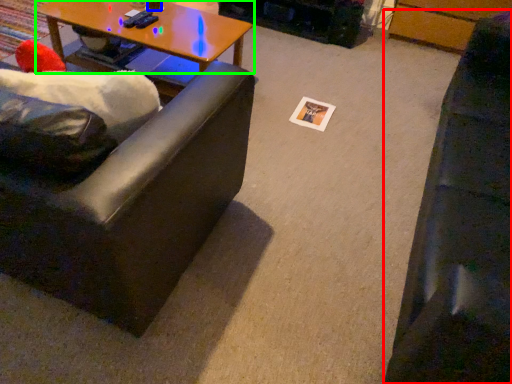
Question: Which object is the closest to the studio couch (highlighted by a red box)? Choose among these: coffee cup (highlighted by a blue box) or coffee table (highlighted by a green box).

Choices:
 (A) coffee cup
 (B) coffee table

Answer: (B)